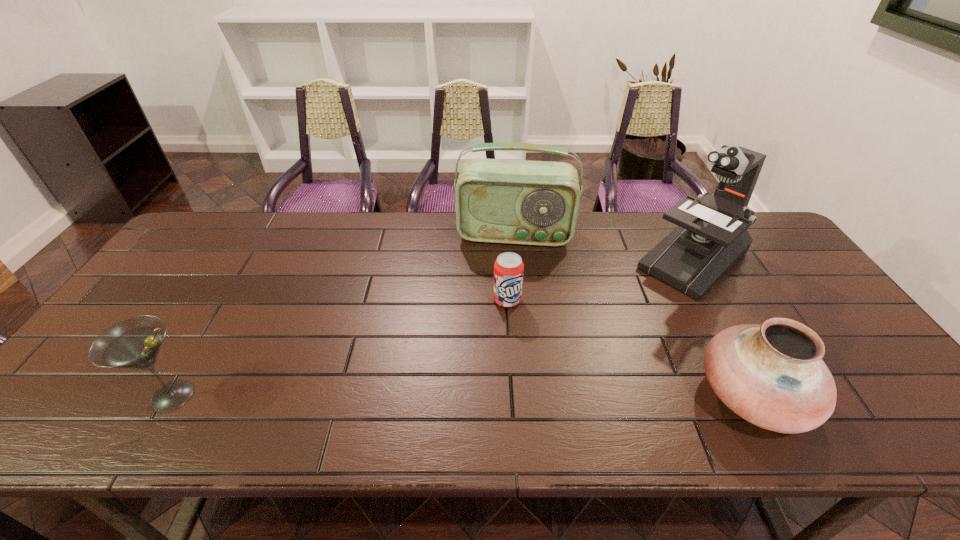
The image size is (960, 540). Identify the location of object present at the right edge. (711, 237).

This screenshot has width=960, height=540. Find the location of `object at the far right corner`. object at the far right corner is located at coordinates (711, 237).

Identify the location of vacant space at the far edge of the desktop. (401, 220).

Where is `free space at the near edge`? free space at the near edge is located at coordinates coord(442,382).

Where is `free spot at the left edge of the desktop`? free spot at the left edge of the desktop is located at coordinates (179, 305).

In the image, there is a desktop. Where is `vacant space at the right edge`? This screenshot has width=960, height=540. vacant space at the right edge is located at coordinates (849, 337).

The width and height of the screenshot is (960, 540). I want to click on vacant region at the far left corner of the desktop, so click(189, 241).

Image resolution: width=960 pixels, height=540 pixels. I want to click on free spot between the shortest object and the martini, so click(340, 348).

The width and height of the screenshot is (960, 540). Identify the location of vacant area that lies between the pottery and the microscope. (723, 328).

Locate an element on the screen. free spot between the pottery and the martini is located at coordinates (463, 395).